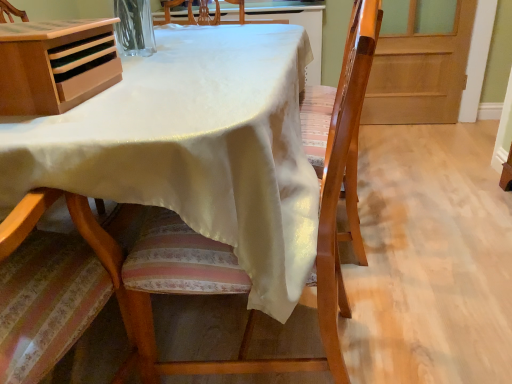
Question: From the image's perspective, is light brown wood desk at upper left over wooden screen door at right?

Choices:
 (A) yes
 (B) no

Answer: (B)

Question: Is light brown wood desk at upper left turned away from wooden screen door at right?

Choices:
 (A) no
 (B) yes

Answer: (A)

Question: Can you confirm if light brown wood desk at upper left is bigger than wooden screen door at right?

Choices:
 (A) yes
 (B) no

Answer: (B)

Question: Is light brown wood desk at upper left further to camera compared to wooden screen door at right?

Choices:
 (A) yes
 (B) no

Answer: (B)

Question: From a real-world perspective, is light brown wood desk at upper left below wooden screen door at right?

Choices:
 (A) yes
 (B) no

Answer: (B)

Question: From a real-world perspective, is light brown wood desk at upper left on top of wooden screen door at right?

Choices:
 (A) yes
 (B) no

Answer: (A)

Question: Can you confirm if wooden screen door at right is smaller than wooden chair at center?

Choices:
 (A) yes
 (B) no

Answer: (A)

Question: From a real-world perspective, is wooden screen door at right positioned over wooden chair at center based on gravity?

Choices:
 (A) no
 (B) yes

Answer: (A)

Question: Can you confirm if wooden screen door at right is positioned to the left of wooden chair at center?

Choices:
 (A) yes
 (B) no

Answer: (B)

Question: From a real-world perspective, is wooden screen door at right beneath wooden chair at center?

Choices:
 (A) no
 (B) yes

Answer: (B)

Question: Is wooden screen door at right to the right of wooden chair at center from the viewer's perspective?

Choices:
 (A) no
 (B) yes

Answer: (B)

Question: Is wooden screen door at right oriented away from wooden chair at center?

Choices:
 (A) no
 (B) yes

Answer: (A)

Question: Is light brown wood desk at upper left shorter than wooden chair at center?

Choices:
 (A) yes
 (B) no

Answer: (A)